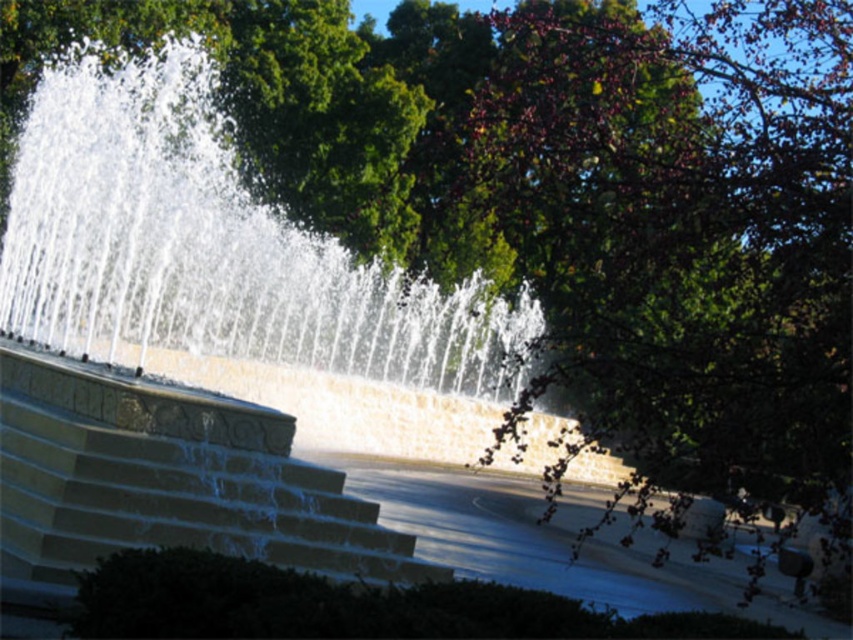
Is clear water at center wider than stone stairs at center?

Yes.

Is clear water at center bigger than stone stairs at center?

Yes.

Who is more distant from viewer, (x=276, y=248) or (x=308, y=540)?

Point (x=276, y=248)

The width and height of the screenshot is (853, 640). In order to click on clear water at center in this screenshot , I will do `click(212, 248)`.